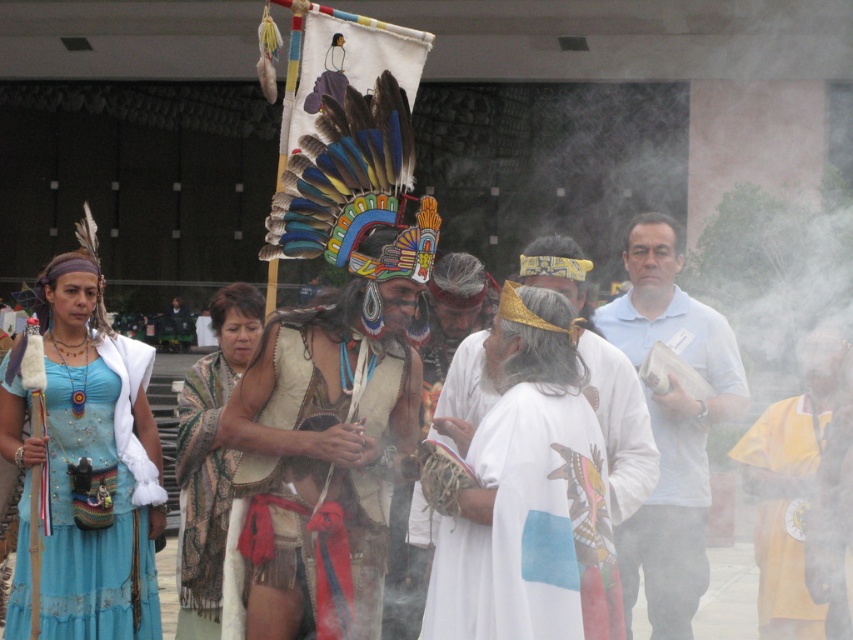
Question: Is white matte/soft fabric at center further to the viewer compared to matte blue dress at left?

Choices:
 (A) no
 (B) yes

Answer: (A)

Question: From the image, what is the correct spatial relationship of leather fringe skirt at center in relation to white matte/soft fabric at center?

Choices:
 (A) left
 (B) right

Answer: (A)

Question: Which point is farther from the camera taking this photo?

Choices:
 (A) (3, 384)
 (B) (186, 484)
 (C) (312, 392)

Answer: (B)

Question: Which object appears farthest from the camera in this image?

Choices:
 (A) patterned fabric shawl at center
 (B) leather fringe skirt at center

Answer: (A)

Question: Which point appears closest to the camera in this image?

Choices:
 (A) (26, 608)
 (B) (648, 522)
 (C) (241, 438)

Answer: (C)

Question: Can you confirm if matte blue dress at left is wider than yellow fabric shawl at right?

Choices:
 (A) yes
 (B) no

Answer: (B)